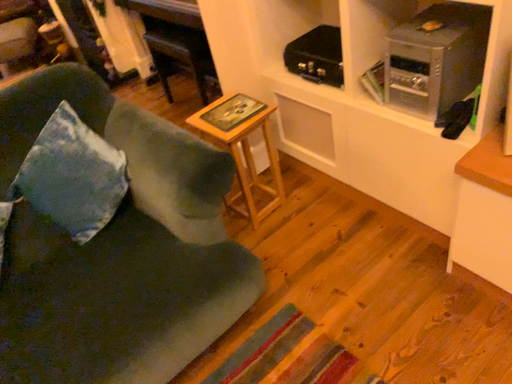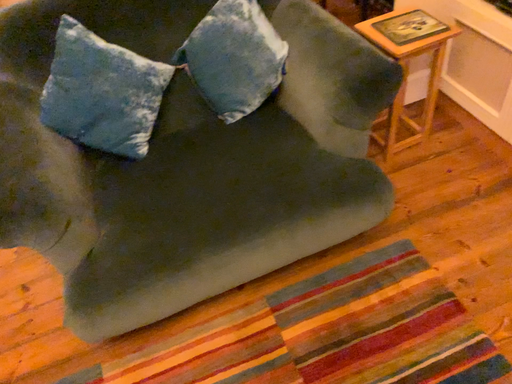
Question: Which way did the camera rotate in the video?

Choices:
 (A) rotated left
 (B) rotated right

Answer: (A)